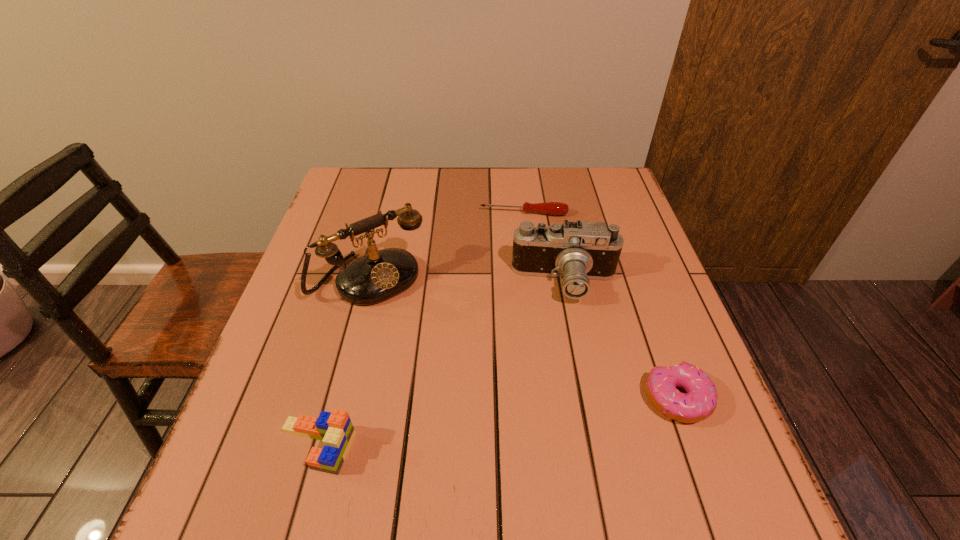
Locate an element on the screen. Image resolution: width=960 pixels, height=540 pixels. free spot on the desktop that is between the third shortest object and the second shortest object and is positioned on the dial of the telephone is located at coordinates (485, 424).

Find the location of a particular element. vacant space on the desktop that is between the third shortest object and the second shortest object and is positioned at the tip of the shortest object is located at coordinates (520, 420).

The width and height of the screenshot is (960, 540). Find the location of `vacant space on the desktop that is between the third tallest object and the second shortest object and is positioned at the lens of the camera`. vacant space on the desktop that is between the third tallest object and the second shortest object and is positioned at the lens of the camera is located at coordinates (546, 416).